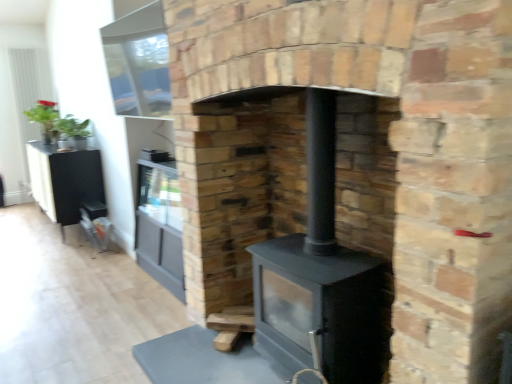
Question: Is black matte wood burning stove at center completely or partially inside black matte entertainment center at left?

Choices:
 (A) yes
 (B) no

Answer: (B)

Question: From the image's perspective, is black matte entertainment center at left beneath black matte wood burning stove at center?

Choices:
 (A) no
 (B) yes

Answer: (A)

Question: Considering the relative sizes of black matte entertainment center at left and black matte wood burning stove at center in the image provided, is black matte entertainment center at left smaller than black matte wood burning stove at center?

Choices:
 (A) no
 (B) yes

Answer: (A)

Question: Is black matte entertainment center at left positioned far away from black matte wood burning stove at center?

Choices:
 (A) yes
 (B) no

Answer: (A)

Question: From a real-world perspective, is black matte entertainment center at left physically below black matte wood burning stove at center?

Choices:
 (A) yes
 (B) no

Answer: (A)

Question: In the image, is black matte entertainment center at left on the left side or the right side of black matte wood stove at center?

Choices:
 (A) right
 (B) left

Answer: (B)

Question: Relative to black matte wood stove at center, is black matte entertainment center at left in front or behind?

Choices:
 (A) behind
 (B) front

Answer: (A)

Question: In terms of width, does black matte entertainment center at left look wider or thinner when compared to black matte wood stove at center?

Choices:
 (A) thin
 (B) wide

Answer: (A)

Question: Based on their sizes in the image, would you say black matte entertainment center at left is bigger or smaller than black matte wood stove at center?

Choices:
 (A) small
 (B) big

Answer: (A)

Question: In terms of size, does black matte wood burning stove at center appear bigger or smaller than black matte wood stove at center?

Choices:
 (A) big
 (B) small

Answer: (B)

Question: Which is correct: black matte wood burning stove at center is inside black matte wood stove at center, or outside of it?

Choices:
 (A) outside
 (B) inside

Answer: (B)

Question: From the image's perspective, relative to black matte wood stove at center, is black matte wood burning stove at center above or below?

Choices:
 (A) above
 (B) below

Answer: (B)

Question: In terms of width, does black matte wood burning stove at center look wider or thinner when compared to black matte wood stove at center?

Choices:
 (A) thin
 (B) wide

Answer: (A)

Question: Is point (354, 354) closer or farther from the camera than point (84, 173)?

Choices:
 (A) farther
 (B) closer

Answer: (B)

Question: Considering the relative positions of black matte wood burning stove at center and black matte entertainment center at left in the image provided, is black matte wood burning stove at center to the left or to the right of black matte entertainment center at left?

Choices:
 (A) left
 (B) right

Answer: (B)